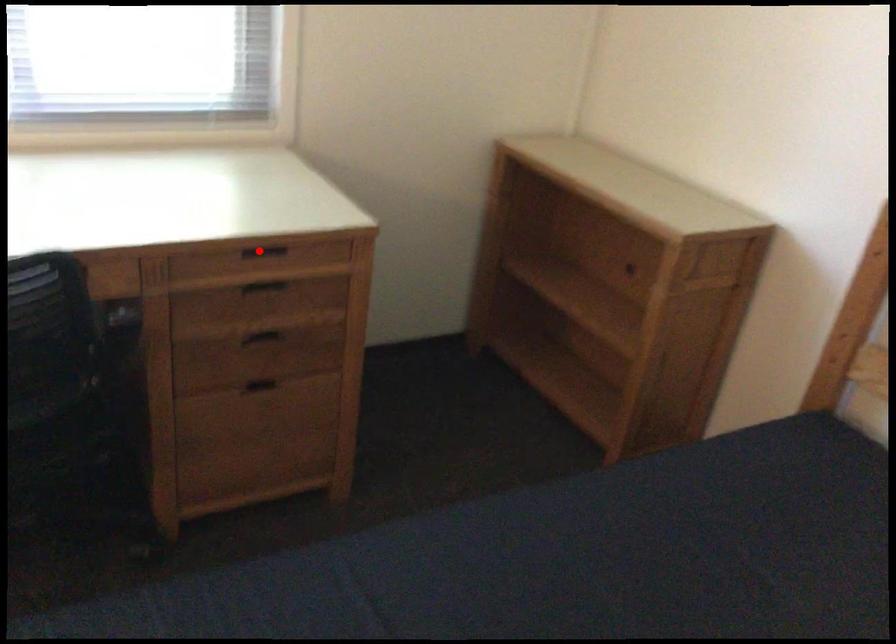
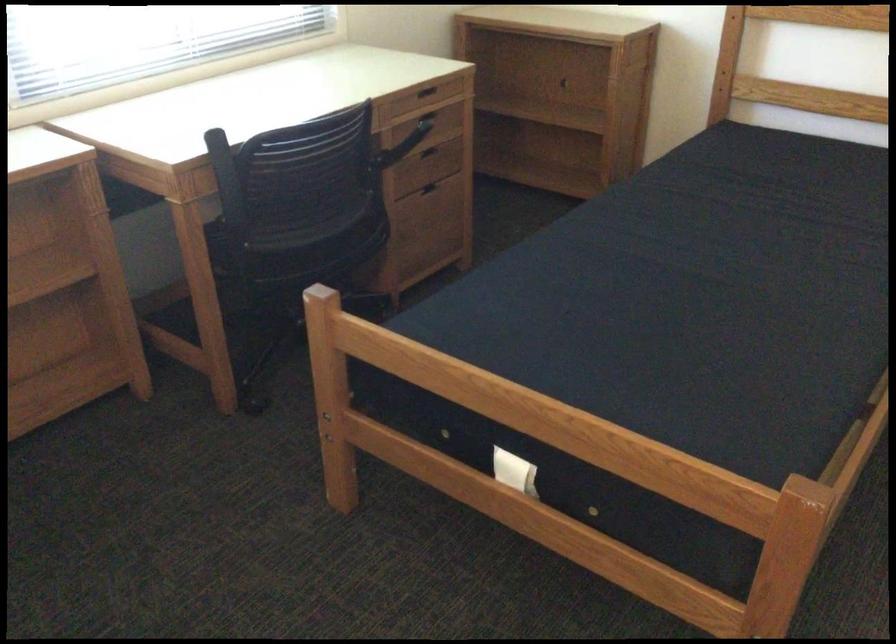
In the second image, find the point that corresponds to the highlighted location in the first image.

(424, 91)